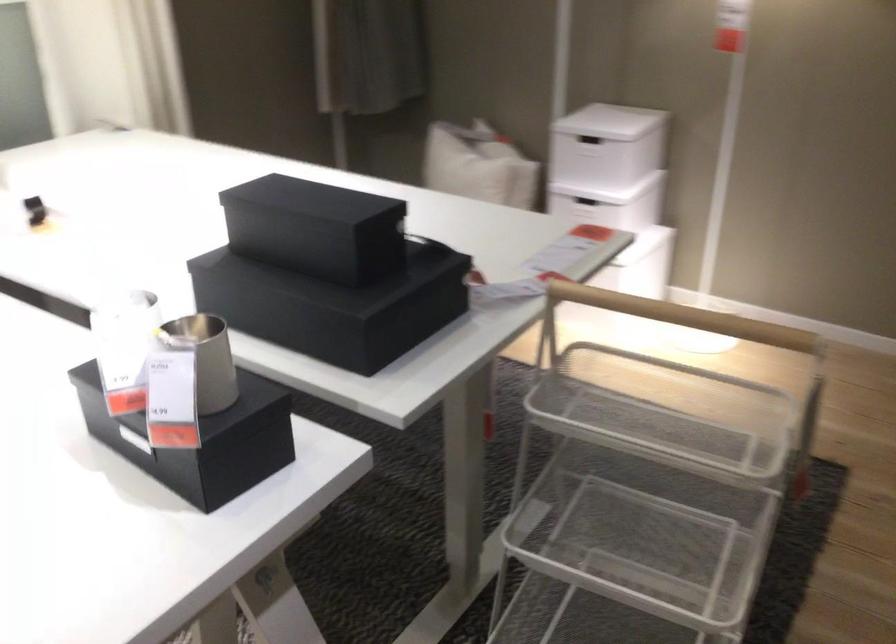
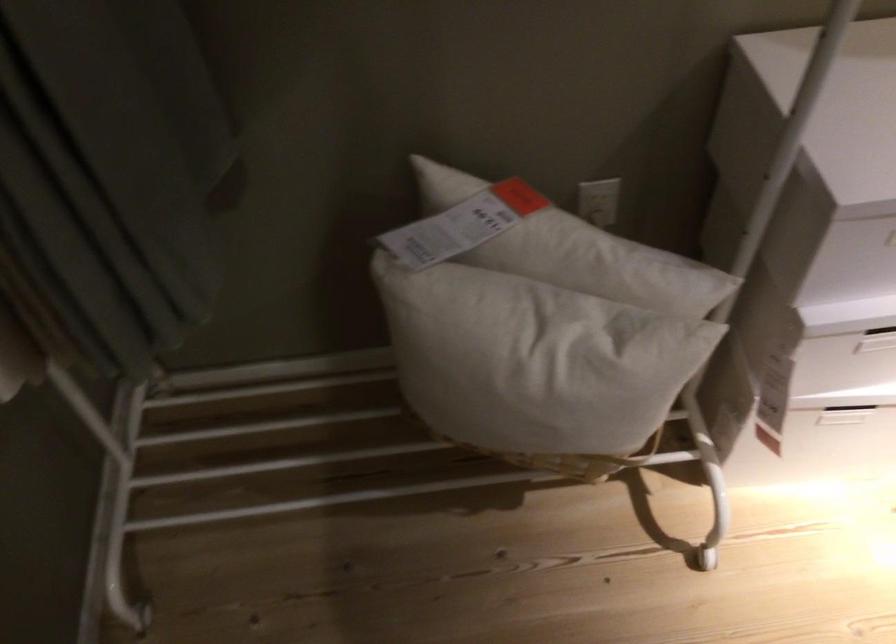
In the second image, find the point that corresponds to [460,158] in the first image.

(538, 363)